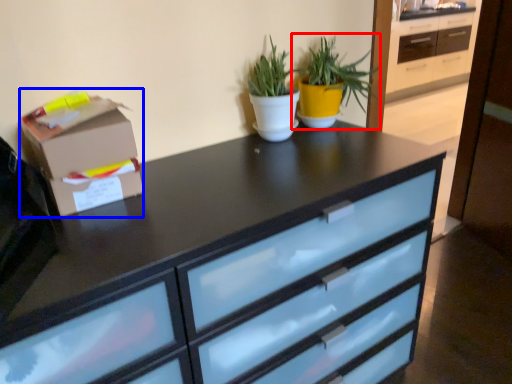
Question: Which object appears closest to the camera in this image, houseplant (highlighted by a red box) or cardboard box (highlighted by a blue box)?

Choices:
 (A) houseplant
 (B) cardboard box

Answer: (B)